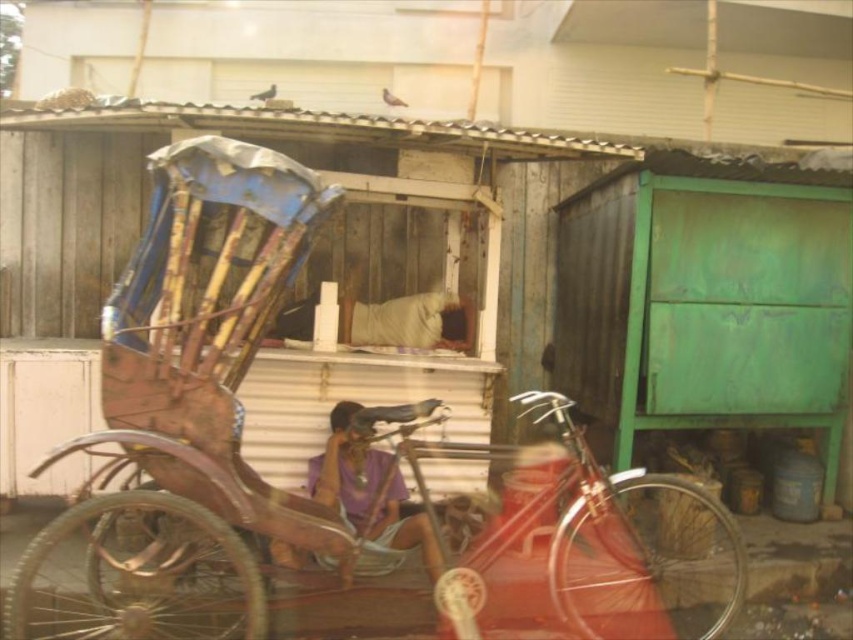
Does point (564, 573) lie behind point (381, 506)?

That is False.

Which of these two, rusty wood rickshaw at center or purple fabric at center, stands shorter?

Standing shorter between the two is purple fabric at center.

Where is `rusty wood rickshaw at center`? The width and height of the screenshot is (853, 640). rusty wood rickshaw at center is located at coordinates (328, 472).